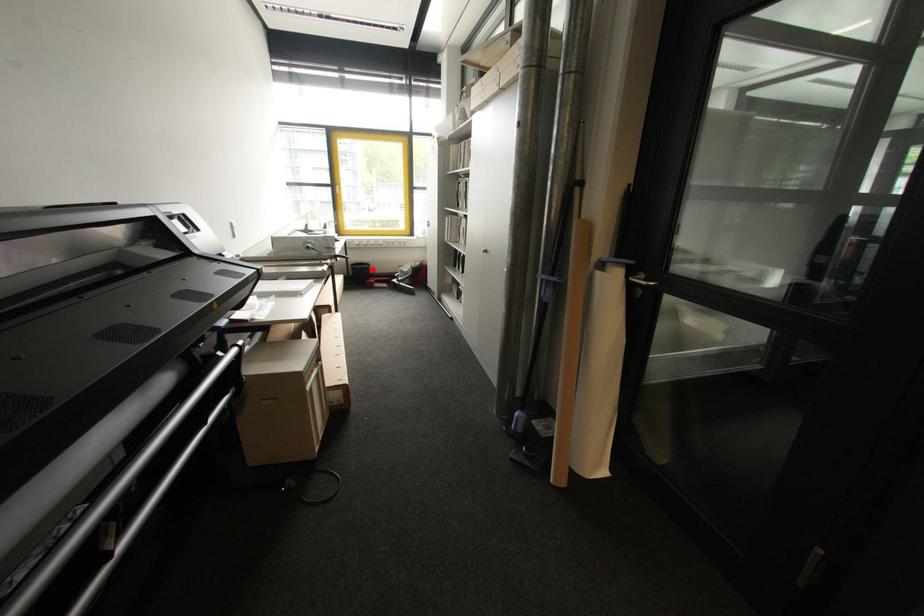
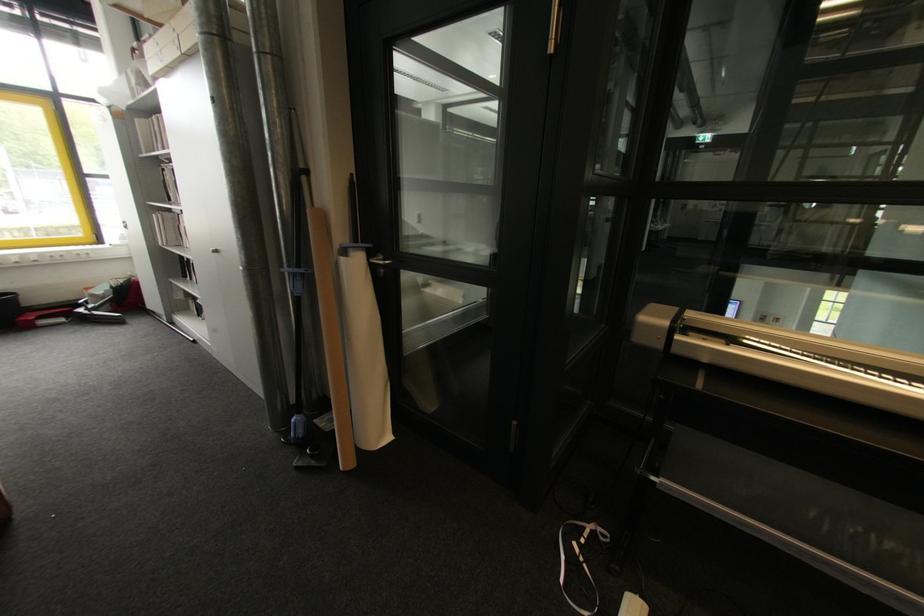
Where in the second image is the point corresponding to the highlighted location from the first image?

(19, 301)